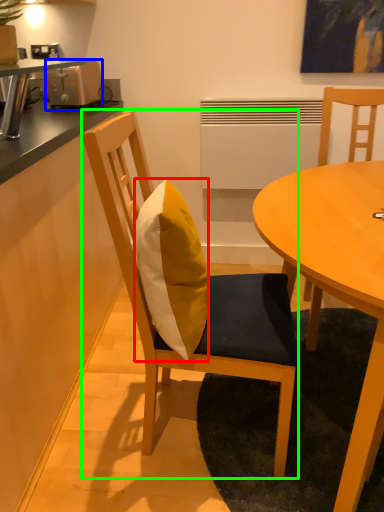
Question: Which object is the closest to the pillow (highlighted by a red box)? Choose among these: toaster (highlighted by a blue box) or chair (highlighted by a green box).

Choices:
 (A) toaster
 (B) chair

Answer: (B)